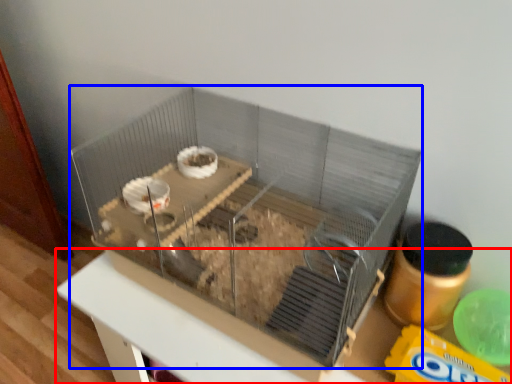
Question: Which point is closer to the camera, table (highlighted by a red box) or glass box (highlighted by a blue box)?

Choices:
 (A) table
 (B) glass box

Answer: (B)